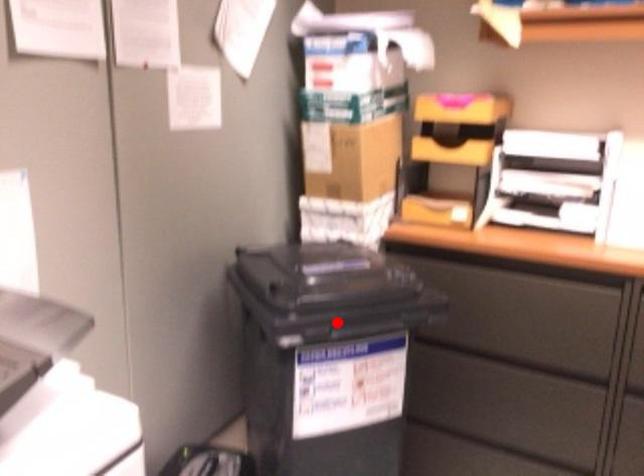
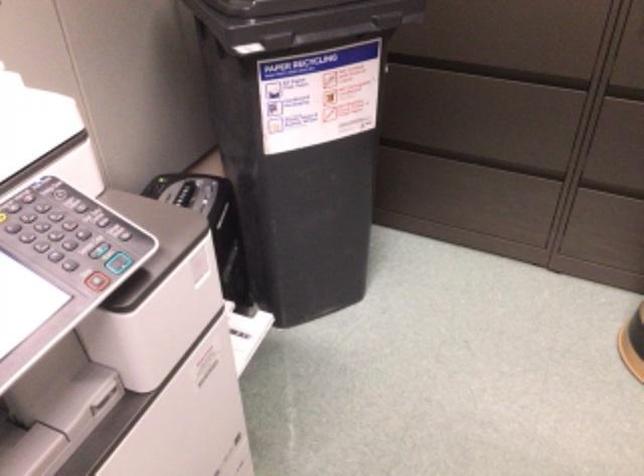
Question: I am providing you with two images of the same scene from different viewpoints. Image1 has a red point marked. In image2, the corresponding 3D location appears at what relative position? Reply with the corresponding letter.

Choices:
 (A) Closer
 (B) Farther

Answer: (A)